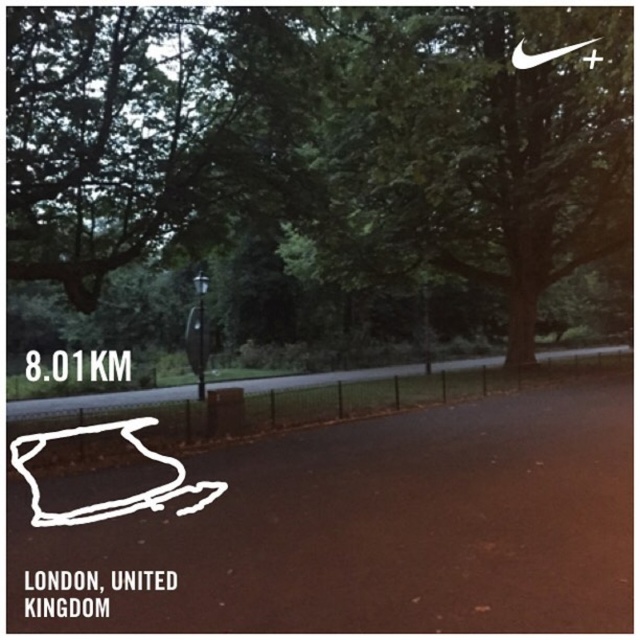
Question: Which of the following is the farthest from the observer?

Choices:
 (A) coord(205,340)
 (B) coord(284,20)

Answer: (A)

Question: Is green leafy tree at center behind metallic pole at center?

Choices:
 (A) no
 (B) yes

Answer: (A)

Question: Which point is closer to the camera?

Choices:
 (A) (209, 348)
 (B) (140, 29)

Answer: (B)

Question: Does green leafy tree at center have a smaller size compared to metallic pole at center?

Choices:
 (A) yes
 (B) no

Answer: (B)

Question: Can you confirm if green leafy tree at center is positioned to the right of metallic pole at center?

Choices:
 (A) no
 (B) yes

Answer: (B)

Question: Among these points, which one is farthest from the camera?

Choices:
 (A) (35, 225)
 (B) (196, 352)

Answer: (B)